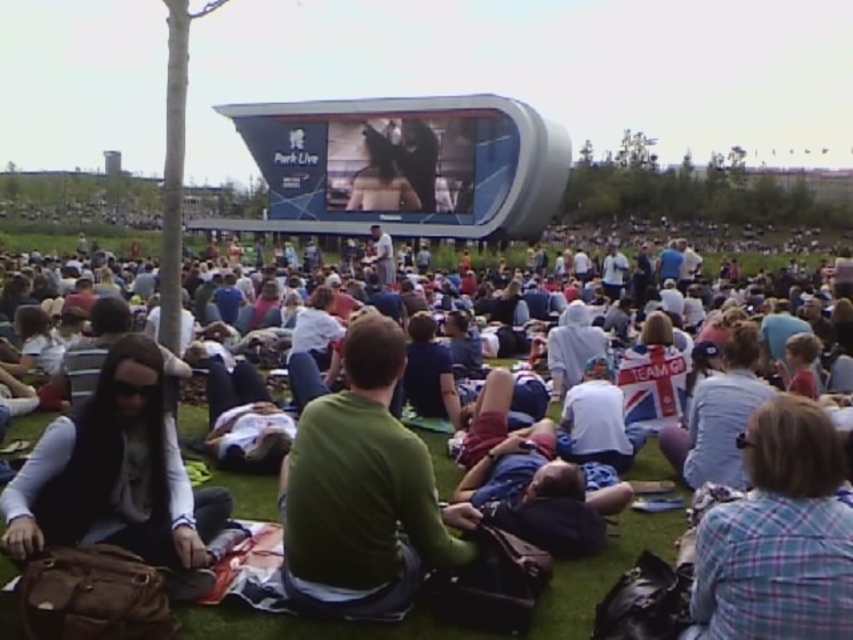
You are a photographer at the Park Live event. You need to capture a clear photo of both the green matte shirt at center and the plaid fabric shirt at lower right. Which shirt should you focus on first to ensure both are in frame?

The green matte shirt at center is larger in size than the plaid fabric shirt at lower right, so you should focus on the plaid fabric shirt at lower right first to ensure both are in frame.

You are a photographer trying to capture a photo of the green cotton shirt at center and the brown leather backpack at lower left. Based on their sizes, which object should you focus on to ensure both fit in the frame without cropping?

The green cotton shirt at center might be wider than brown leather backpack at lower left, so focusing on the green cotton shirt at center would ensure both fit in the frame as it is wider and likely occupies more space.